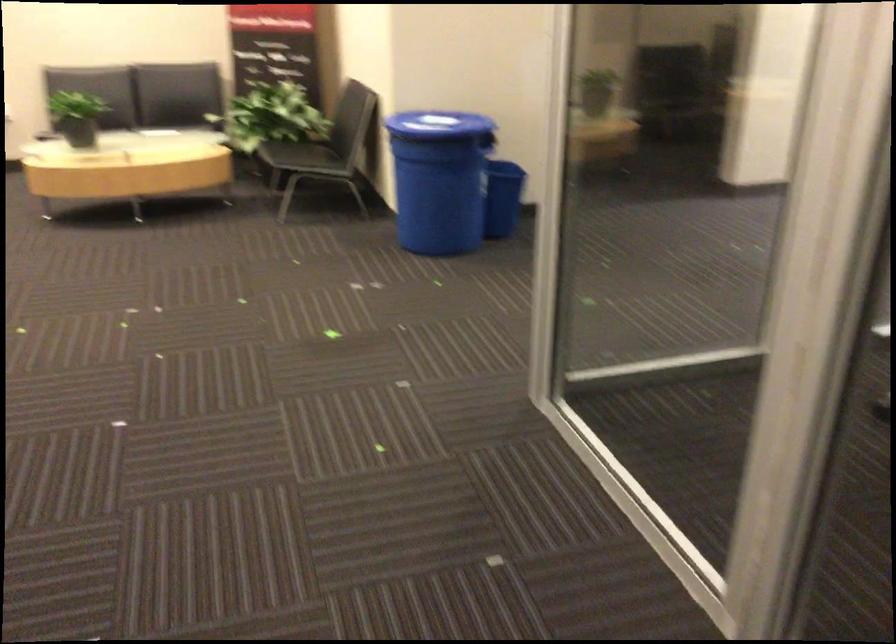
What do you see at coordinates (300, 156) in the screenshot? I see `the black chair sitting surface` at bounding box center [300, 156].